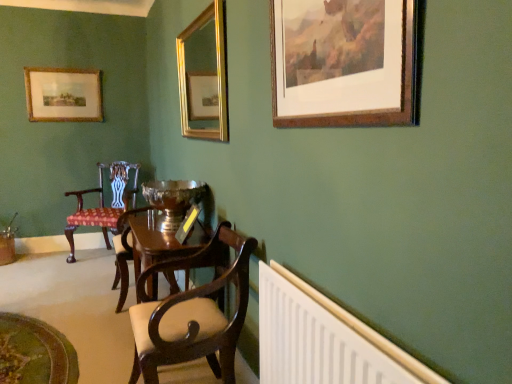
Question: From the image's perspective, is white plastic radiator at lower right above or below mahogany wood chair at center, placed as the 2th chair when sorted from back to front?

Choices:
 (A) below
 (B) above

Answer: (A)

Question: In terms of height, does white plastic radiator at lower right look taller or shorter compared to mahogany wood chair at center, placed as the 2th chair when sorted from back to front?

Choices:
 (A) tall
 (B) short

Answer: (B)

Question: Which of these objects is positioned farthest from the mahogany wood armchair at center?

Choices:
 (A) mahogany wood chair at center, placed as the first chair when sorted from front to back
 (B) wooden picture frame at upper left, arranged as the third picture frame when viewed from the right
 (C) gold metallic mirror at upper center, the second picture frame viewed from the back
 (D) white plastic radiator at lower right
 (E) polka dot fabric chair at left, which ranks as the 1th chair in back-to-front order

Answer: (D)

Question: Which is farther from the wooden picture frame at upper left, the 1th picture frame from the left?

Choices:
 (A) white plastic radiator at lower right
 (B) gold metallic mirror at upper center, the second picture frame viewed from the back
 (C) polka dot fabric chair at left, the second chair positioned from the right
 (D) mahogany wood chair at center, placed as the 2th chair when sorted from back to front
 (E) mahogany wood armchair at center

Answer: (A)